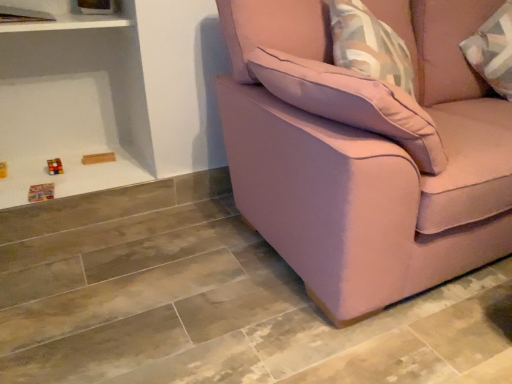
Identify the location of white glossy shelf at upper left. (59, 16).

Looking at this image, what is the approximate height of pink fabric couch at right?

The height of pink fabric couch at right is 37.37 inches.

The height and width of the screenshot is (384, 512). What are the coordinates of `white glossy shelf at upper left` in the screenshot? It's located at (59, 16).

In the scene shown: From the image's perspective, relative to pink fabric pillow at upper right, is pink fabric couch at right above or below?

pink fabric couch at right is below pink fabric pillow at upper right.

In the scene shown: Which is more to the left, pink fabric couch at right or pink fabric pillow at upper right?

Positioned to the left is pink fabric pillow at upper right.

Is pink fabric couch at right positioned beyond the bounds of pink fabric pillow at upper right?

pink fabric couch at right lies outside pink fabric pillow at upper right's area.

In the scene shown: Is pink fabric couch at right located within pink fabric pillow at upper right?

Actually, pink fabric couch at right is outside pink fabric pillow at upper right.

From a real-world perspective, is pink fabric pillow at upper right above or below pink fabric couch at right?

Clearly, from a real-world perspective, pink fabric pillow at upper right is above pink fabric couch at right.

Considering the positions of points (378, 107) and (350, 152), is point (378, 107) farther from camera compared to point (350, 152)?

No, (378, 107) is in front of (350, 152).

Between pink fabric pillow at upper right and pink fabric couch at right, which one appears on the left side from the viewer's perspective?

pink fabric pillow at upper right is more to the left.

Which object is positioned more to the right, white glossy shelf at upper left or pink fabric couch at right?

Positioned to the right is pink fabric couch at right.

In the scene shown: From the image's perspective, does white glossy shelf at upper left appear lower than pink fabric couch at right?

Actually, white glossy shelf at upper left appears above pink fabric couch at right in the image.

Is white glossy shelf at upper left facing away from pink fabric couch at right?

No.

This screenshot has height=384, width=512. In order to click on studio couch on the right of the white glossy shelf at upper left in this screenshot , I will do point(368,160).

Considering the points (348, 122) and (97, 27), which point is in front, point (348, 122) or point (97, 27)?

Point (348, 122)

Can you confirm if pink fabric pillow at upper right is bigger than white glossy shelf at upper left?

Correct, pink fabric pillow at upper right is larger in size than white glossy shelf at upper left.

Based on the photo, visually, is pink fabric pillow at upper right positioned to the left or to the right of white glossy shelf at upper left?

pink fabric pillow at upper right is positioned on white glossy shelf at upper left's right side.

Is pink fabric couch at right in contact with white glossy shelf at upper left?

No, pink fabric couch at right is not touching white glossy shelf at upper left.

Image resolution: width=512 pixels, height=384 pixels. I want to click on shelf above the pink fabric couch at right (from the image's perspective), so click(x=59, y=16).

Looking at this image, is pink fabric couch at right positioned beyond the bounds of white glossy shelf at upper left?

That's correct, pink fabric couch at right is outside of white glossy shelf at upper left.

Is point (99, 14) more distant than point (350, 72)?

Yes, it is.

From the image's perspective, would you say white glossy shelf at upper left is positioned over pink fabric pillow at upper right?

Yes, from the image's perspective, white glossy shelf at upper left is over pink fabric pillow at upper right.

Visually, is white glossy shelf at upper left positioned to the left or to the right of pink fabric pillow at upper right?

white glossy shelf at upper left is positioned on pink fabric pillow at upper right's left side.

From a real-world perspective, is white glossy shelf at upper left physically located above or below pink fabric pillow at upper right?

Clearly, from a real-world perspective, white glossy shelf at upper left is above pink fabric pillow at upper right.

This screenshot has width=512, height=384. In order to click on studio couch located on the right of pink fabric pillow at upper right in this screenshot , I will do pos(368,160).

Identify the location of pillow that appears behind the pink fabric couch at right. The height and width of the screenshot is (384, 512). (352, 102).

Looking at this image, which object lies nearer to the anchor point pink fabric pillow at upper right, pink fabric couch at right or white glossy shelf at upper left?

Based on the image, pink fabric couch at right appears to be nearer to pink fabric pillow at upper right.

Estimate the real-world distances between objects in this image. Which object is closer to white glossy shelf at upper left, pink fabric couch at right or pink fabric pillow at upper right?

Based on the image, pink fabric pillow at upper right appears to be nearer to white glossy shelf at upper left.

Which object lies further to the anchor point pink fabric pillow at upper right, white glossy shelf at upper left or pink fabric couch at right?

white glossy shelf at upper left is positioned further to the anchor pink fabric pillow at upper right.

Estimate the real-world distances between objects in this image. Which object is further from pink fabric couch at right, white glossy shelf at upper left or pink fabric pillow at upper right?

white glossy shelf at upper left lies further to pink fabric couch at right than the other object.

Looking at this image, looking at the image, which one is located further to pink fabric couch at right, pink fabric pillow at upper right or white glossy shelf at upper left?

white glossy shelf at upper left.

Which object lies further to the anchor point white glossy shelf at upper left, pink fabric pillow at upper right or pink fabric couch at right?

The object further to white glossy shelf at upper left is pink fabric couch at right.

Identify the location of pillow situated between white glossy shelf at upper left and pink fabric couch at right from left to right. Image resolution: width=512 pixels, height=384 pixels. (352, 102).